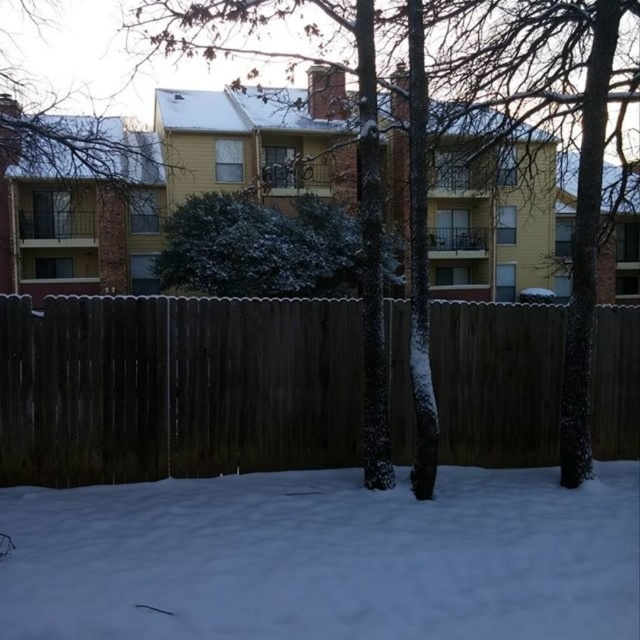
You are a gardener who wants to trim the green textured bush at center and the smooth bark tree at upper center. Which one do you need to use a ladder for?

The smooth bark tree at upper center is taller than the green textured bush at center, so you need to use a ladder for the smooth bark tree at upper center.

You are standing in the snowy residential area and want to take a photo of the dark brown wood fence at center and the smooth bark tree at upper center. Which object will appear closer to the top of your photo?

The smooth bark tree at upper center will appear closer to the top of the photo because it is positioned above the dark brown wood fence at center.

You are a gardener who wants to plant a new bush that is the same size as the green textured bush at center. The garden space available is limited and can only accommodate plants smaller than the smooth bark tree at upper center. Will the new bush fit in the space?

The green textured bush at center has a smaller size compared to the smooth bark tree at upper center. Since the new bush will be the same size as the green textured bush at center, it will fit in the space as it is smaller than the smooth bark tree at upper center.